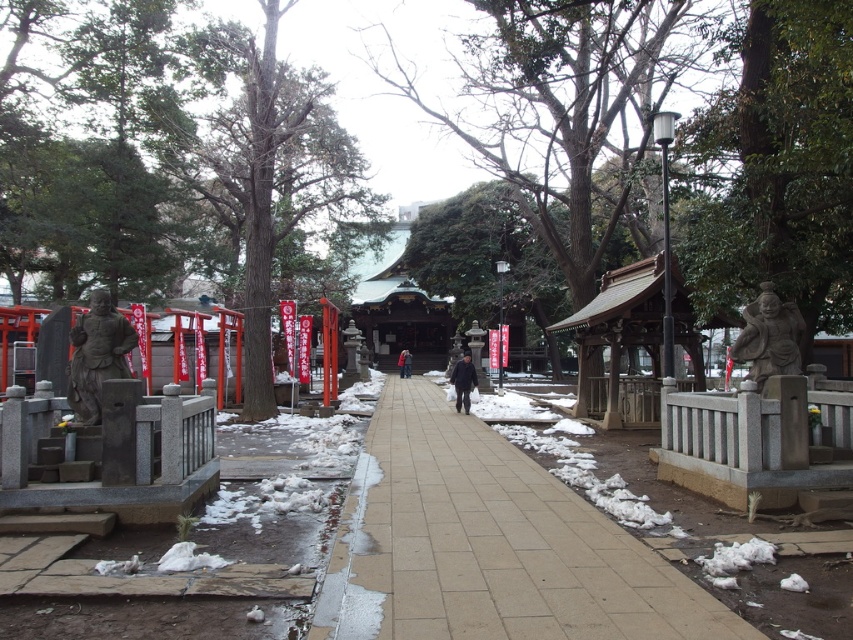
Question: Can you confirm if stone statue at left is wider than stone statue at right?

Choices:
 (A) yes
 (B) no

Answer: (A)

Question: Does stone statue at left come behind dark brown leather jacket at center?

Choices:
 (A) yes
 (B) no

Answer: (B)

Question: Can you confirm if stone statue at right is positioned to the left of dark blue fabric coat at center?

Choices:
 (A) yes
 (B) no

Answer: (B)

Question: Estimate the real-world distances between objects in this image. Which object is farther from the dark brown leather jacket at center?

Choices:
 (A) stone statue at left
 (B) smooth concrete pavement at center
 (C) dark blue fabric coat at center
 (D) stone statue at right

Answer: (D)

Question: Which point appears closest to the camera in this image?

Choices:
 (A) (402, 358)
 (B) (462, 401)
 (C) (102, 348)
 (D) (502, 634)

Answer: (D)

Question: Among these points, which one is nearest to the camera?

Choices:
 (A) (466, 401)
 (B) (407, 374)
 (C) (91, 330)

Answer: (C)